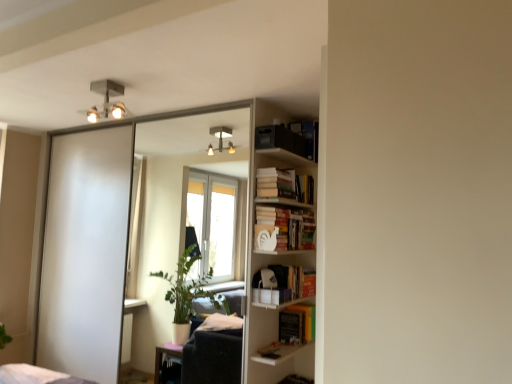
Question: From a real-world perspective, is white matte bookshelf at right physically located above or below matte black bookshelf at upper right, which is counted as the 4th book, starting from the bottom?

Choices:
 (A) above
 (B) below

Answer: (B)

Question: Based on their positions, is white matte bookshelf at right located to the left or right of matte black bookshelf at upper right, which ranks as the 1th book in top-to-bottom order?

Choices:
 (A) right
 (B) left

Answer: (A)

Question: Estimate the real-world distances between objects in this image. Which object is closer to the metallic square light fixture at upper center?

Choices:
 (A) hardcover books at upper center, acting as the 2th book starting from the top
 (B) matte black bookshelf at upper right, which ranks as the 1th book in top-to-bottom order
 (C) clear glass mirror at upper center
 (D) white matte bookshelf at center-right, placed as the second book when sorted from bottom to top
 (E) white matte bookshelf at right

Answer: (B)

Question: Which is nearer to the yellow matte book at center, which ranks as the 1th book in bottom-to-top order?

Choices:
 (A) hardcover books at upper center, acting as the third book starting from the bottom
 (B) white matte bookshelf at right
 (C) white matte bookshelf at center-right, acting as the third book starting from the top
 (D) matte black bookshelf at upper right, which is counted as the 4th book, starting from the bottom
 (E) metallic square light fixture at upper center

Answer: (B)